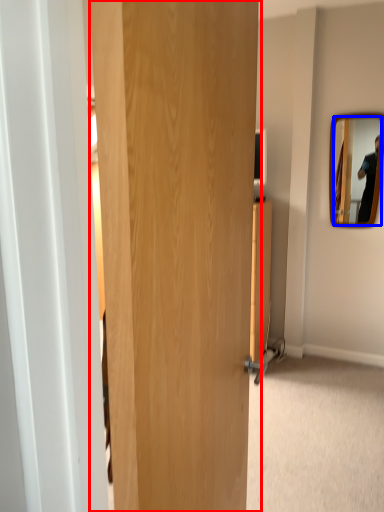
Question: Among these objects, which one is nearest to the camera, door (highlighted by a red box) or mirror (highlighted by a blue box)?

Choices:
 (A) door
 (B) mirror

Answer: (A)